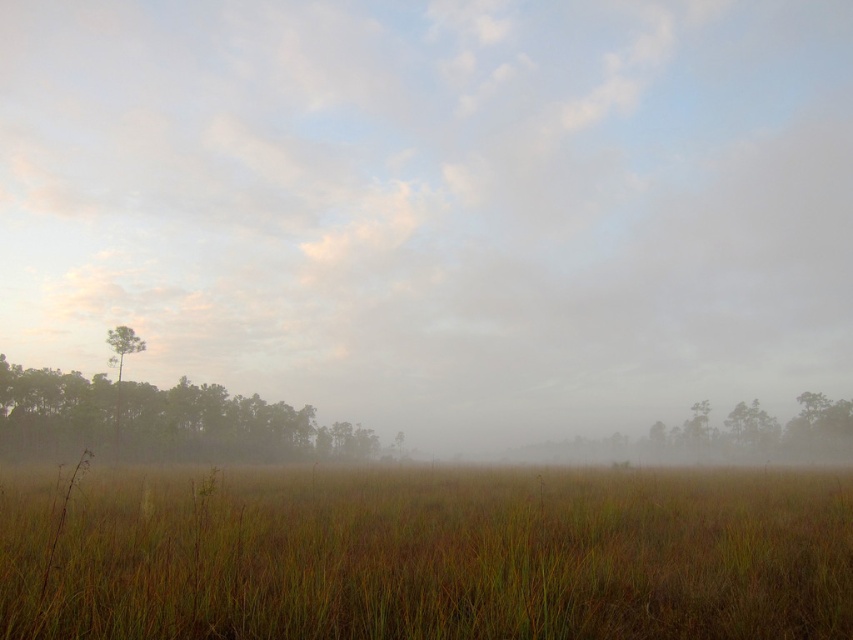
You are an artist planning to paint the misty field scene. You want to emphasize the depth by showing the size difference between the green matte tree at left and the green matte tree at center. Which tree should you paint larger to create this effect?

You should paint the green matte tree at left larger than the green matte tree at center because it is naturally larger in the scene.

You are standing in the misty field and want to walk towards the green matte tree at center. Which direction should you move relative to the foggy grassland at lower center?

To reach the green matte tree at center from the foggy grassland at lower center, you should move to the right since the foggy grassland at lower center is located to the left of the tree.